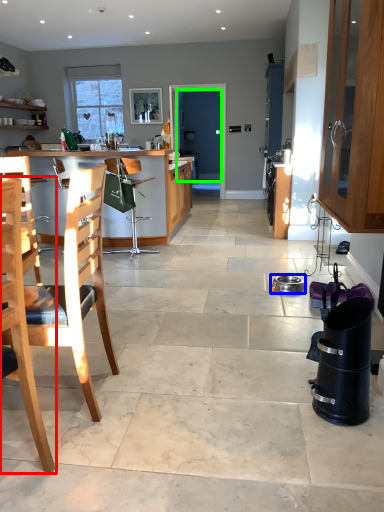
Question: Considering the real-world distances, which object is farthest from chair (highlighted by a red box)? appliance (highlighted by a blue box) or screen door (highlighted by a green box)?

Choices:
 (A) appliance
 (B) screen door

Answer: (B)